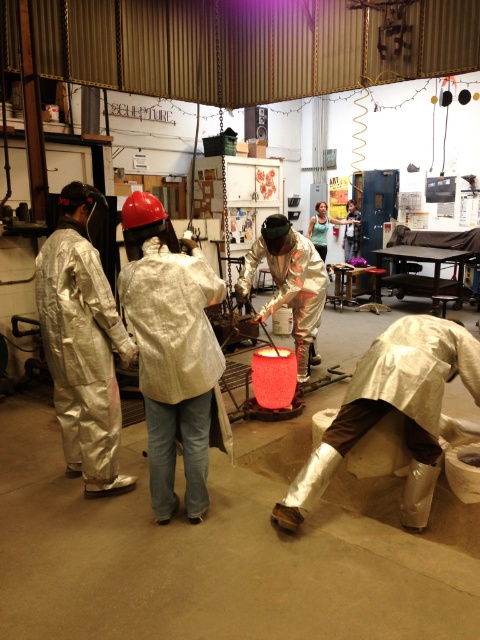
In the scene shown: Based on the coordinates provided, which object is located at point [83,342]?

The silver reflective suit at left is located at point [83,342].